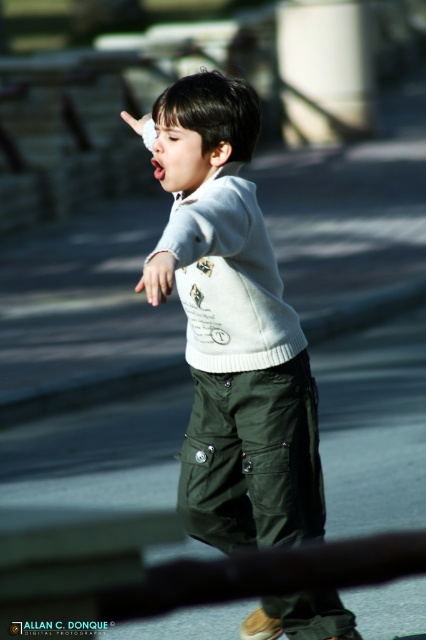
Question: Which point appears farthest from the camera in this image?

Choices:
 (A) (221, 371)
 (B) (141, 124)
 (C) (157, 266)
 (D) (193, 467)

Answer: (B)

Question: Estimate the real-world distances between objects in this image. Which object is closer to the white knitted sweater at center?

Choices:
 (A) white matte hand at center
 (B) white matte sweater at center
 (C) matte green cargo pants at lower center

Answer: (B)

Question: Is white knitted sweater at center below white matte hand at center?

Choices:
 (A) no
 (B) yes

Answer: (B)

Question: Where is white knitted sweater at center located in relation to matte green cargo pants at lower center in the image?

Choices:
 (A) below
 (B) above

Answer: (B)

Question: Estimate the real-world distances between objects in this image. Which object is farther from the white matte sweater at center?

Choices:
 (A) white knitted sweater at center
 (B) matte green cargo pants at lower center
 (C) white matte hand at center

Answer: (C)

Question: Is white matte sweater at center bigger than white matte hand at center?

Choices:
 (A) yes
 (B) no

Answer: (B)